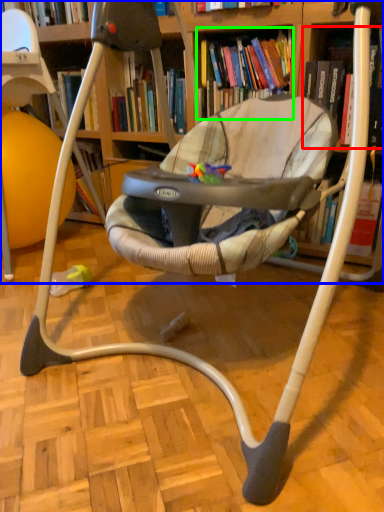
Question: Which is nearer to the book (highlighted by a red box)? bookcase (highlighted by a blue box) or book (highlighted by a green box).

Choices:
 (A) bookcase
 (B) book

Answer: (B)